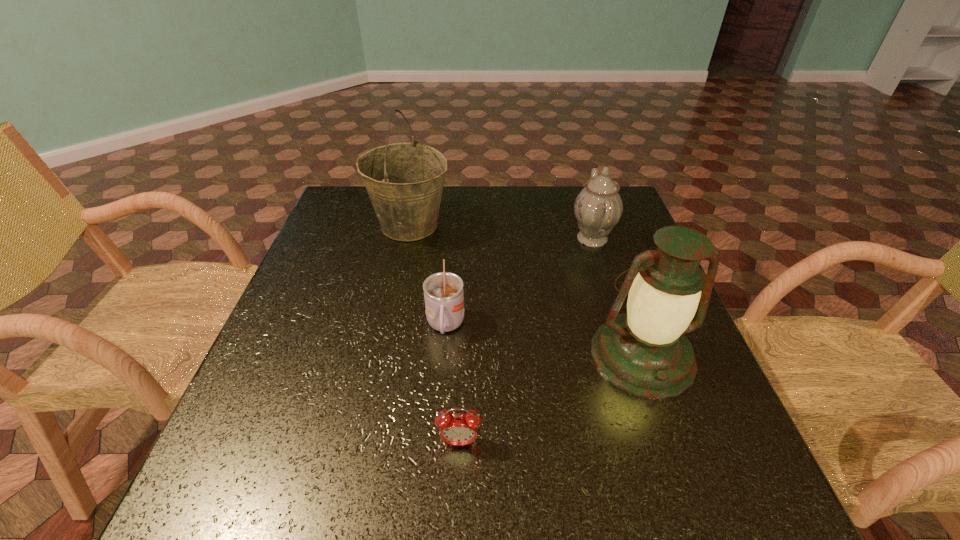
This screenshot has width=960, height=540. Identify the location of free space located 0.210m on the spout of the third tallest object. (493, 238).

Find the location of a particular element. This screenshot has height=540, width=960. free space located 0.260m on the side with the handle of the cup is located at coordinates (434, 472).

Find the location of a particular element. This screenshot has width=960, height=540. vacant position located on the face of the shortest object is located at coordinates (457, 512).

Find the location of a particular element. wine bucket positioned at the far edge is located at coordinates (404, 181).

Identify the location of chinaware that is at the far edge. (598, 207).

Where is `object that is at the left edge`? This screenshot has width=960, height=540. object that is at the left edge is located at coordinates (404, 181).

Find the location of a particular element. The width and height of the screenshot is (960, 540). lantern at the right edge is located at coordinates pos(645,352).

Where is `chinaware that is at the right edge`? chinaware that is at the right edge is located at coordinates (598, 207).

Where is `object positioned at the far left corner`? The width and height of the screenshot is (960, 540). object positioned at the far left corner is located at coordinates (x=404, y=181).

Where is `object positioned at the far right corner`? Image resolution: width=960 pixels, height=540 pixels. object positioned at the far right corner is located at coordinates (598, 207).